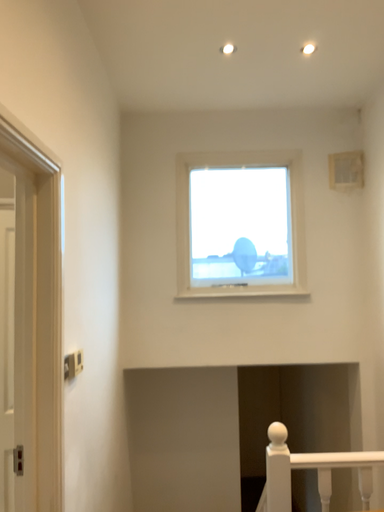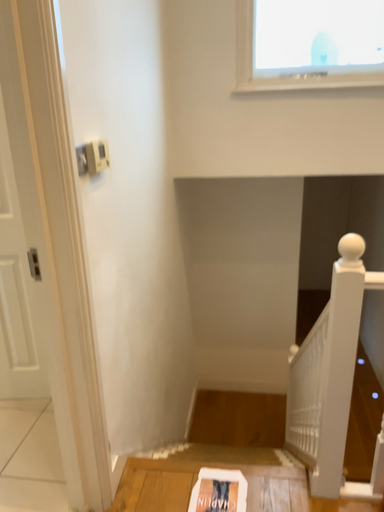
Question: How did the camera likely rotate when shooting the video?

Choices:
 (A) rotated left
 (B) rotated right

Answer: (A)